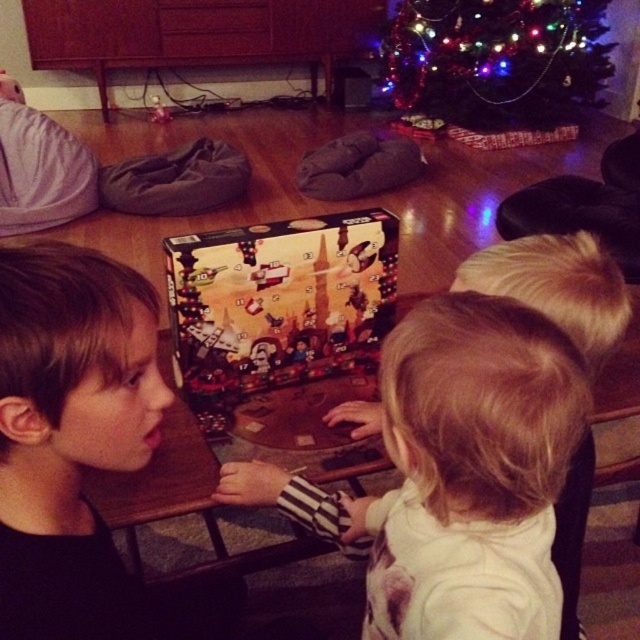
Looking at this image, you are a parent trying to take a photo of your child with the white soft shirt at center and the printed cardboard advent calendar at center. The camera you are using has a minimum focusing distance of 16 inches. Can you take a clear photo without moving either object?

The white soft shirt at center is 16.76 inches from the printed cardboard advent calendar at center. Since the camera requires a minimum focusing distance of 16 inches, the distance between them is sufficient, so you can take a clear photo without moving either object.

Where is the brown matte hair at center located in the image?

The brown matte hair at center is located at point (70, 436).